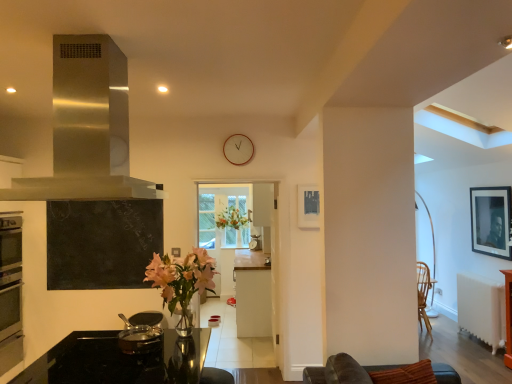
Locate an element on the screen. The height and width of the screenshot is (384, 512). matte black picture frame at center, which ranks as the first picture frame in front-to-back order is located at coordinates (308, 206).

Identify the location of black matte picture frame at upper right, which appears as the 1th picture frame when viewed from the right. (490, 221).

Describe the element at coordinates (490, 221) in the screenshot. The height and width of the screenshot is (384, 512). I see `black matte picture frame at upper right, positioned as the 2th picture frame in left-to-right order` at that location.

Image resolution: width=512 pixels, height=384 pixels. What do you see at coordinates (141, 333) in the screenshot?
I see `shiny metallic pot at lower left` at bounding box center [141, 333].

The height and width of the screenshot is (384, 512). In order to click on matte black picture frame at center, which ranks as the first picture frame in front-to-back order in this screenshot , I will do `click(308, 206)`.

Are shiny metallic pot at lower left and wooden clock at center making contact?

No, shiny metallic pot at lower left is not making contact with wooden clock at center.

From a real-world perspective, which object stands above the other?

wooden clock at center, from a real-world perspective.

From the image's perspective, does shiny metallic pot at lower left appear lower than wooden clock at center?

Yes.

Between shiny metallic pot at lower left and wooden clock at center, which one has more height?

With more height is wooden clock at center.

Is white matte cabinet at center to the left of brown leather couch at lower right from the viewer's perspective?

Yes.

Considering the relative sizes of white matte cabinet at center and brown leather couch at lower right in the image provided, is white matte cabinet at center taller than brown leather couch at lower right?

Correct, white matte cabinet at center is much taller as brown leather couch at lower right.

Consider the image. From a real-world perspective, between white matte cabinet at center and brown leather couch at lower right, who is vertically higher?

brown leather couch at lower right, from a real-world perspective.

Are white matte cabinet at center and brown leather couch at lower right far apart?

Absolutely, white matte cabinet at center is distant from brown leather couch at lower right.

In the scene shown: Visually, is wooden clock at center positioned to the left or to the right of white matte cabinet at center?

Based on their positions, wooden clock at center is located to the left of white matte cabinet at center.

Between wooden clock at center and white matte cabinet at center, which one has smaller size?

Smaller between the two is wooden clock at center.

How different are the orientations of wooden clock at center and white matte cabinet at center in degrees?

wooden clock at center and white matte cabinet at center are facing 87.4 degrees away from each other.

From a real-world perspective, who is located lower, wooden clock at center or white matte cabinet at center?

From a 3D spatial view, white matte cabinet at center is below.

How many degrees apart are the facing directions of white matte cabinet at center and wooden clock at center?

There is a 87.4-degree angle between the facing directions of white matte cabinet at center and wooden clock at center.

Looking at this image, considering their positions, is white matte cabinet at center located in front of or behind wooden clock at center?

In the image, white matte cabinet at center appears behind wooden clock at center.

At what (x,y) coordinates should I click in order to perform the action: click on clock above the white matte cabinet at center (from a real-world perspective). Please return your answer as a coordinate pair (x, y). Image resolution: width=512 pixels, height=384 pixels. Looking at the image, I should click on (238, 149).

How distant is white matte cabinet at center from wooden clock at center?

white matte cabinet at center is 1.37 meters from wooden clock at center.

Would you consider shiny metallic pot at lower left to be distant from matte black picture frame at center, which ranks as the first picture frame in front-to-back order?

Absolutely, shiny metallic pot at lower left is distant from matte black picture frame at center, which ranks as the first picture frame in front-to-back order.

Does shiny metallic pot at lower left have a larger size compared to matte black picture frame at center, which ranks as the first picture frame in front-to-back order?

Yes, shiny metallic pot at lower left is bigger than matte black picture frame at center, which ranks as the first picture frame in front-to-back order.

Is shiny metallic pot at lower left at the left side of matte black picture frame at center, which is the 1th picture frame in left-to-right order?

Indeed, shiny metallic pot at lower left is positioned on the left side of matte black picture frame at center, which is the 1th picture frame in left-to-right order.

Is pink glass vase at center far away from black matte picture frame at upper right, which appears as the 1th picture frame when viewed from the right?

That's right, there is a large distance between pink glass vase at center and black matte picture frame at upper right, which appears as the 1th picture frame when viewed from the right.

Who is smaller, pink glass vase at center or black matte picture frame at upper right, positioned as the 2th picture frame in left-to-right order?

Smaller between the two is black matte picture frame at upper right, positioned as the 2th picture frame in left-to-right order.

Is pink glass vase at center behind black matte picture frame at upper right, which appears as the 1th picture frame when viewed from the right?

No, pink glass vase at center is closer to the camera.

From a real-world perspective, is pink glass vase at center beneath black matte picture frame at upper right, which appears as the 1th picture frame when viewed from the right?

Indeed, from a real-world perspective, pink glass vase at center is positioned beneath black matte picture frame at upper right, which appears as the 1th picture frame when viewed from the right.

From the image's perspective, which one is positioned lower, brown leather couch at lower right or black matte picture frame at upper right, which appears as the 1th picture frame when viewed from the right?

brown leather couch at lower right appears lower in the image.

Is point (316, 379) positioned behind point (505, 207)?

No.

From a real-world perspective, who is located lower, brown leather couch at lower right or black matte picture frame at upper right, which is the second picture frame from front to back?

brown leather couch at lower right is physically lower.

Considering the relative positions of brown leather couch at lower right and black matte picture frame at upper right, positioned as the 2th picture frame in left-to-right order, in the image provided, is brown leather couch at lower right to the left or to the right of black matte picture frame at upper right, positioned as the 2th picture frame in left-to-right order,?

Clearly, brown leather couch at lower right is on the left of black matte picture frame at upper right, positioned as the 2th picture frame in left-to-right order, in the image.

The image size is (512, 384). I want to click on appliance below the wooden clock at center (from a real-world perspective), so click(141, 333).

Locate an element on the screen. The image size is (512, 384). couch on the right of white matte cabinet at center is located at coordinates (343, 371).

Looking at the image, which one is located closer to black matte picture frame at upper right, which is the second picture frame from front to back, wooden clock at center or stainless steel exhaust hood at upper left?

Among the two, wooden clock at center is located nearer to black matte picture frame at upper right, which is the second picture frame from front to back.

From the image, which object appears to be nearer to shiny metallic pot at lower left, wooden clock at center or white matte cabinet at center?

The object closer to shiny metallic pot at lower left is white matte cabinet at center.

Considering their positions, is shiny metallic pot at lower left positioned closer to white matte cabinet at center than pink glass vase at center?

The object closer to white matte cabinet at center is pink glass vase at center.

Looking at the image, which one is located further to white matte cabinet at center, pink glass vase at center or stainless steel exhaust hood at upper left?

stainless steel exhaust hood at upper left is positioned further to the anchor white matte cabinet at center.

From the image, which object appears to be nearer to pink glass vase at center, black matte picture frame at upper right, the 1th picture frame in the back-to-front sequence, or shiny metallic pot at lower left?

shiny metallic pot at lower left.

From the image, which object appears to be farther from brown leather couch at lower right, shiny metallic pot at lower left or pink glass vase at center?

shiny metallic pot at lower left is further to brown leather couch at lower right.

Considering their positions, is pink glass vase at center positioned further to wooden clock at center than shiny metallic pot at lower left?

shiny metallic pot at lower left is positioned further to the anchor wooden clock at center.

Based on their spatial positions, is white matte cabinet at center or stainless steel exhaust hood at upper left further from shiny metallic pot at lower left?

white matte cabinet at center lies further to shiny metallic pot at lower left than the other object.

The height and width of the screenshot is (384, 512). Find the location of `couch between pink glass vase at center and black matte picture frame at upper right, which is the second picture frame from front to back, from left to right`. couch between pink glass vase at center and black matte picture frame at upper right, which is the second picture frame from front to back, from left to right is located at coordinates point(343,371).

This screenshot has width=512, height=384. I want to click on flower between stainless steel exhaust hood at upper left and matte black picture frame at center, which is the second picture frame from right to left, along the z-axis, so click(182, 276).

The image size is (512, 384). Identify the location of clock between shiny metallic pot at lower left and black matte picture frame at upper right, which is the second picture frame from front to back, in the horizontal direction. (238, 149).

Locate an element on the screen. This screenshot has width=512, height=384. clock between stainless steel exhaust hood at upper left and matte black picture frame at center, which ranks as the first picture frame in front-to-back order, along the z-axis is located at coordinates (238, 149).